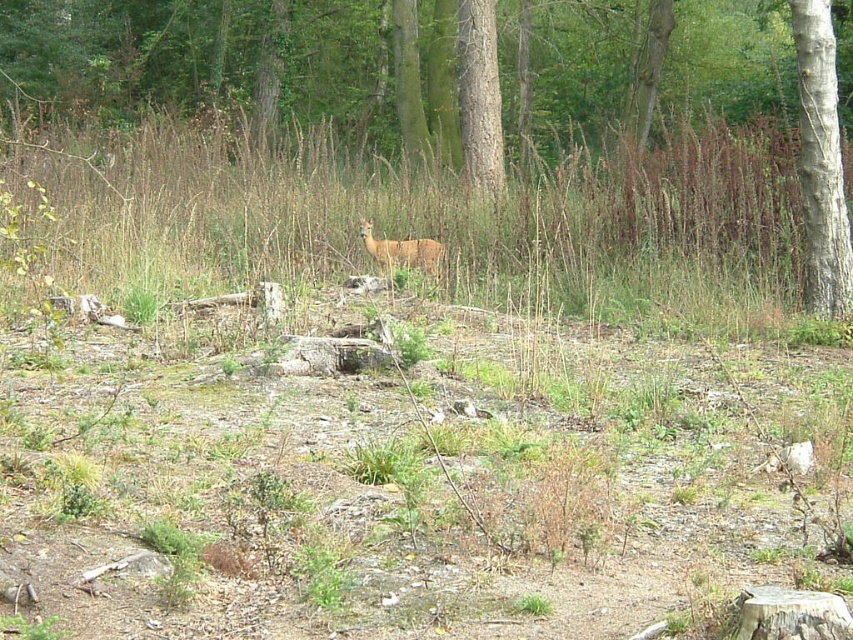
Question: Which of these objects is positioned closest to the brown matte deer at center?

Choices:
 (A) brown wood tree at center
 (B) smooth bark tree at right

Answer: (B)

Question: Which point is closer to the camera taking this photo?

Choices:
 (A) (514, 220)
 (B) (833, 88)

Answer: (B)

Question: Considering the relative positions of brown wood tree at center and smooth bark tree at right in the image provided, where is brown wood tree at center located with respect to smooth bark tree at right?

Choices:
 (A) left
 (B) right

Answer: (A)

Question: Can you confirm if brown wood tree at center is bigger than smooth bark tree at right?

Choices:
 (A) yes
 (B) no

Answer: (A)

Question: Which object is the closest to the brown matte deer at center?

Choices:
 (A) smooth bark tree at right
 (B) brown wood tree at center

Answer: (A)

Question: Is smooth bark tree at right wider than brown matte deer at center?

Choices:
 (A) yes
 (B) no

Answer: (B)